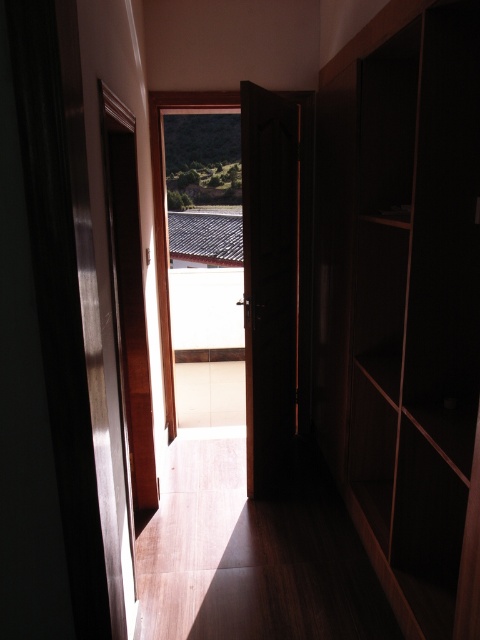
You are standing in the hallway and want to exit to the outdoor area. Which direction should you move relative to the dark wood cabinet at right?

You should move towards the left direction relative to the dark wood cabinet at right since the exit is at the end of the hallway opposite the cabinet.

You are standing in the hallway and want to place a small potted plant exactly at the point marked by point [405,304]. The potted plant has a diameter of 0.1 meters. Is there enough space around the point to place the plant without it touching any nearby objects?

The point [405,304] marks the dark wood cabinet at right. Since the cabinet is an object at that location, placing a potted plant there would mean the plant touches the cabinet. Therefore, there is not enough space to place the plant without it touching the dark wood cabinet at right.

You are moving a large wooden box that is 1.2 meters wide. You are in the hallway and want to move it through the doorway at the end. Can the box fit through the doorway if you go around the dark wood cabinet at right and dark wood door at center?

The dark wood cabinet at right is larger in size than the dark wood door at center, so the doorway might be narrower than the cabinet. Since the box is 1.2 meters wide, it depends on the actual width of the door. However, without specific measurements, it is uncertain if it will fit. Please check the door width before attempting.